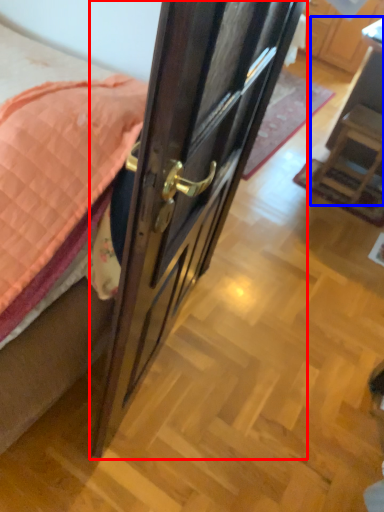
Question: Among these objects, which one is nearest to the camera, door (highlighted by a red box) or furniture (highlighted by a blue box)?

Choices:
 (A) door
 (B) furniture

Answer: (A)